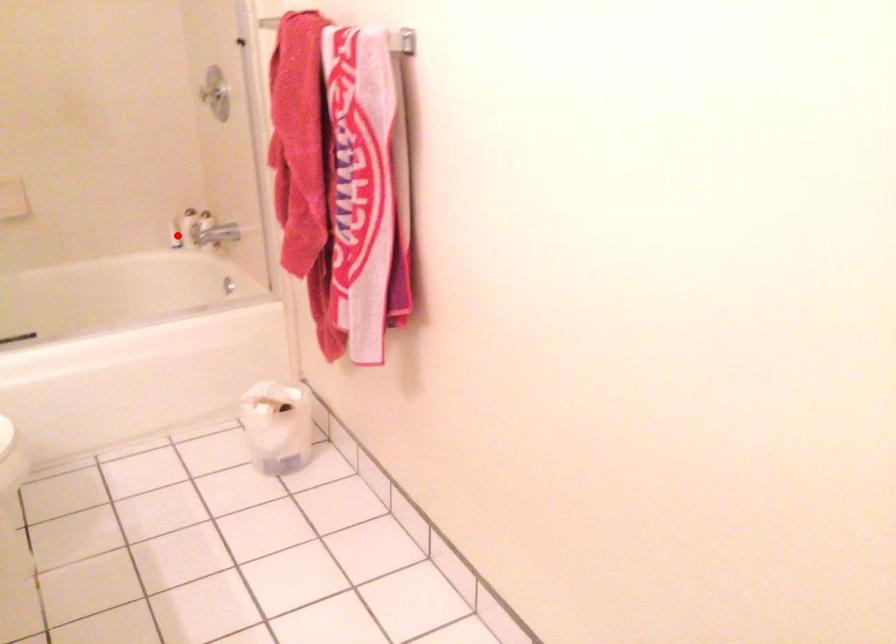
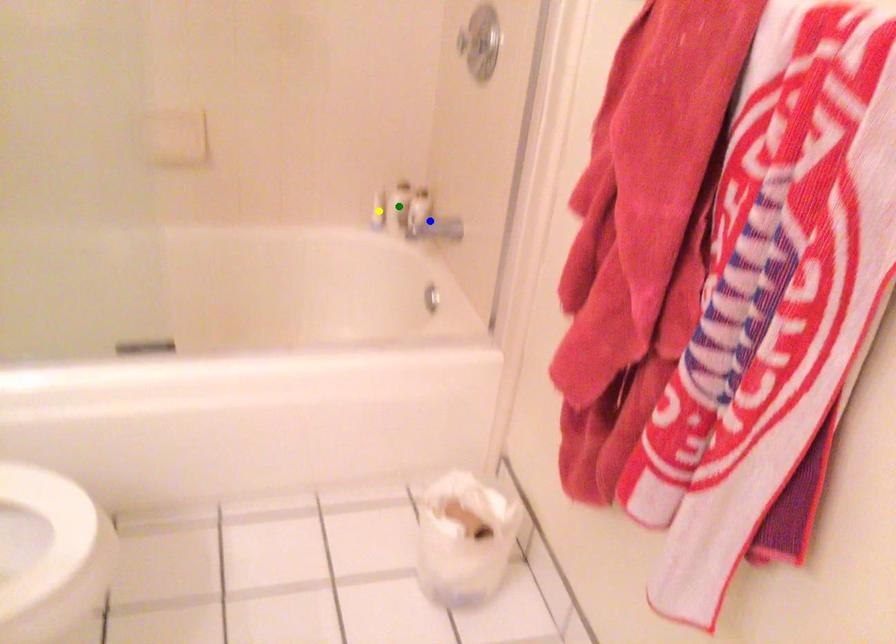
Question: I am providing you with two images of the same scene from different viewpoints. A red point is marked on the first image. You are given multiple points on the second image. Which mark in image 2 goes with the point in image 1?

Choices:
 (A) yellow point
 (B) blue point
 (C) green point

Answer: (A)